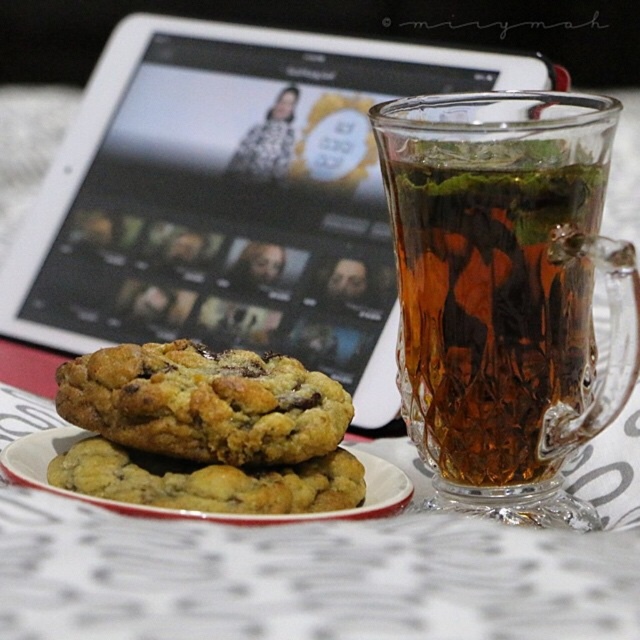
Question: Is brown glass cup at upper right bigger than white ceramic plate at center?

Choices:
 (A) yes
 (B) no

Answer: (A)

Question: Among these objects, which one is nearest to the camera?

Choices:
 (A) brown glass cup at upper right
 (B) golden brown cookie with chocolate chips at center

Answer: (A)

Question: Does golden brown cookie with chocolate chips at center have a smaller size compared to white ceramic plate at center?

Choices:
 (A) yes
 (B) no

Answer: (A)

Question: Is the position of brown glass cup at upper right less distant than that of white ceramic plate at center?

Choices:
 (A) no
 (B) yes

Answer: (A)

Question: Which point is farther to the camera?

Choices:
 (A) 269,520
 (B) 99,385

Answer: (B)

Question: Which of the following is the farthest from the observer?

Choices:
 (A) white ceramic plate at center
 (B) golden brown cookie with chocolate chips at center
 (C) brown glass cup at upper right

Answer: (B)